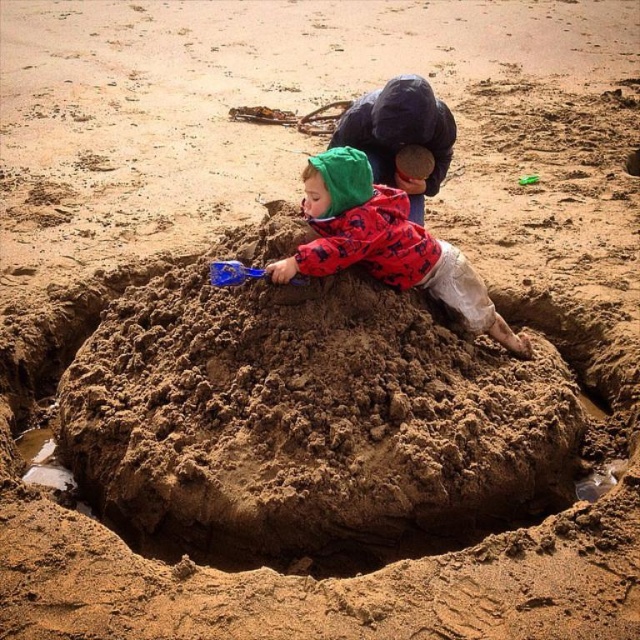
Question: Does matte red jacket at center appear over red plaid shirt at center?

Choices:
 (A) yes
 (B) no

Answer: (B)

Question: Can you confirm if matte red jacket at center is positioned below red plaid shirt at center?

Choices:
 (A) no
 (B) yes

Answer: (B)

Question: Does matte red jacket at center have a lesser width compared to red plaid shirt at center?

Choices:
 (A) yes
 (B) no

Answer: (B)

Question: Which of the following is the farthest from the observer?

Choices:
 (A) click(x=432, y=156)
 (B) click(x=291, y=276)

Answer: (A)

Question: Which object appears farthest from the camera in this image?

Choices:
 (A) blue plastic shovel at center
 (B) matte red jacket at center

Answer: (A)

Question: Which object is positioned closest to the red plaid shirt at center?

Choices:
 (A) blue plastic shovel at center
 (B) matte red jacket at center

Answer: (B)